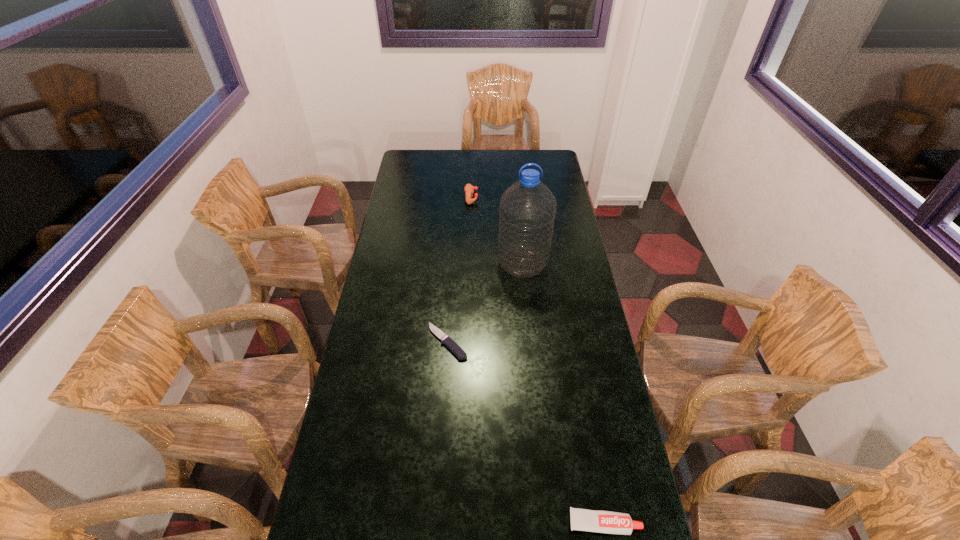
Find the location of a particular element. free point between the puncher and the steak knife is located at coordinates (460, 269).

Image resolution: width=960 pixels, height=540 pixels. What are the coordinates of `empty space that is in between the nearest object and the steak knife` in the screenshot? It's located at (526, 432).

Locate an element on the screen. free space between the farthest object and the shortest object is located at coordinates (460, 269).

Where is `vacant space in between the puncher and the steak knife`? Image resolution: width=960 pixels, height=540 pixels. vacant space in between the puncher and the steak knife is located at coordinates (460, 269).

I want to click on free space between the third farthest object and the farthest object, so click(460, 269).

Locate an element on the screen. This screenshot has height=540, width=960. vacant region between the second tallest object and the nearest object is located at coordinates (538, 360).

Where is `free space between the toothpaste and the farthest object`? free space between the toothpaste and the farthest object is located at coordinates point(538,360).

The width and height of the screenshot is (960, 540). I want to click on free space between the water jug and the nearest object, so click(x=564, y=393).

Locate an element on the screen. The height and width of the screenshot is (540, 960). the second closest object relative to the water jug is located at coordinates (469, 189).

Identify the location of the second closest object to the farthest object. pos(452,345).